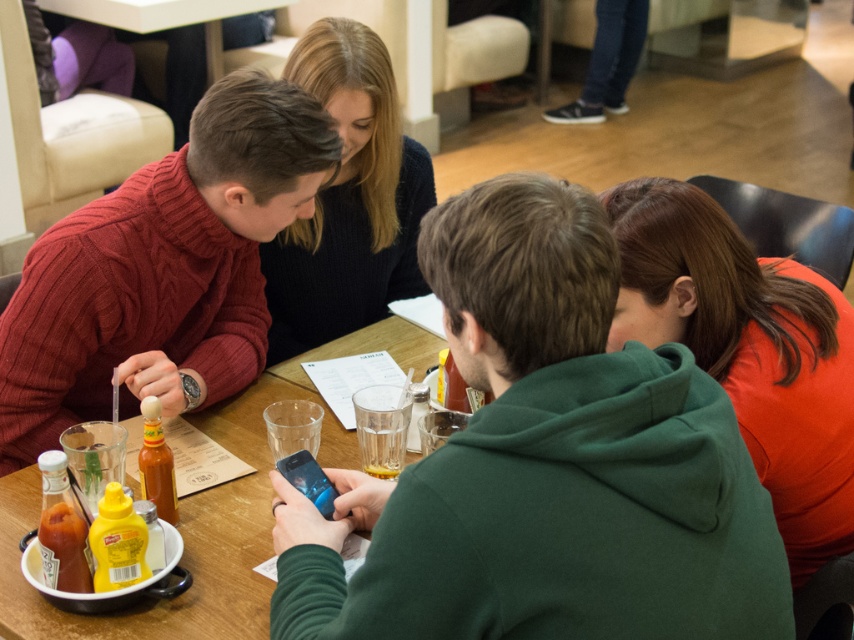
Is cable-knit sweater at left to the left of translucent plastic bottle at center from the viewer's perspective?

Indeed, cable-knit sweater at left is positioned on the left side of translucent plastic bottle at center.

This screenshot has width=854, height=640. Describe the element at coordinates (162, 269) in the screenshot. I see `cable-knit sweater at left` at that location.

Which is behind, point (173, 252) or point (139, 476)?

Positioned behind is point (173, 252).

Identify the location of cable-knit sweater at left. The image size is (854, 640). (162, 269).

Can you confirm if wooden table at center is bigger than translucent plastic bottle at center?

Correct, wooden table at center is larger in size than translucent plastic bottle at center.

Which is behind, point (230, 499) or point (168, 509)?

The point (230, 499) is more distant.

Is point (3, 492) behind point (161, 451)?

Yes, it is.

The image size is (854, 640). Identify the location of wooden table at center. (206, 512).

Can you confirm if knitted dark blue sweater at upper center is positioned below wooden table at center?

Actually, knitted dark blue sweater at upper center is above wooden table at center.

Which is behind, point (314, 83) or point (258, 486)?

Positioned behind is point (314, 83).

Find the location of `knitted dark blue sweater at upper center`. knitted dark blue sweater at upper center is located at coordinates (348, 198).